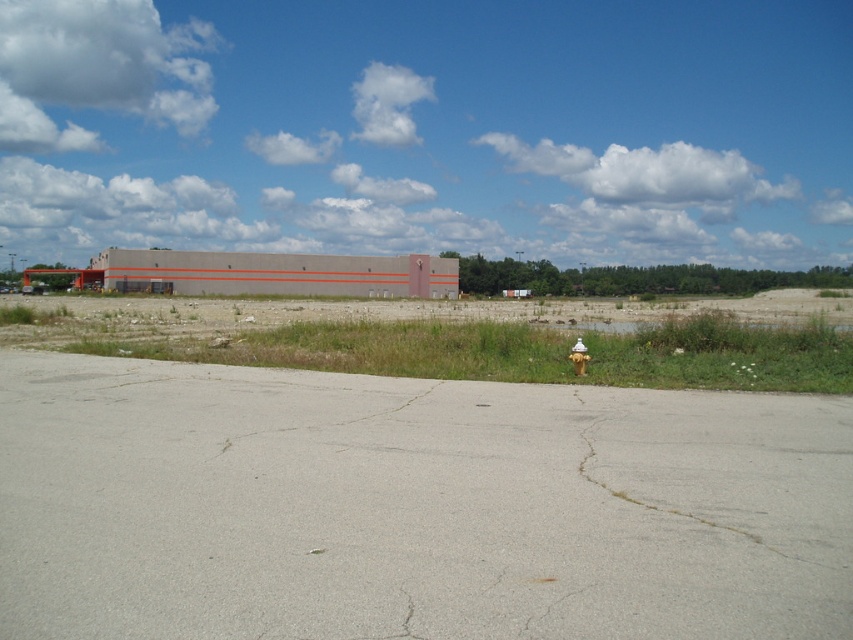
You are a maintenance worker needing to reach the yellow metallic hydrant at center from the gray cracked asphalt at center. Given that your tool cart is 2 meters long, can you safely maneuver it in a straight line between them without hitting any obstacles?

The distance between the gray cracked asphalt at center and the yellow metallic hydrant at center is 3.67 meters. Since the tool cart is 2 meters long, there is sufficient space to maneuver it in a straight line between them without obstacles.

In the scene shown: You are standing at the origin point in the image. Which direction should you move to reach the gray cracked asphalt at center?

The gray cracked asphalt at center is located at point (315, 406), so you should move towards the right and slightly forward to reach it.

You are a delivery driver who needs to park your truck near the yellow metallic hydrant at center. The truck requires a clear space of 3 meters in front of the gray cracked asphalt at center. Is there enough space available?

The gray cracked asphalt at center is below the yellow metallic hydrant at center, but the description does not provide specific measurements about the space available. Therefore, it is unclear if there is enough space for the truck to park as required.